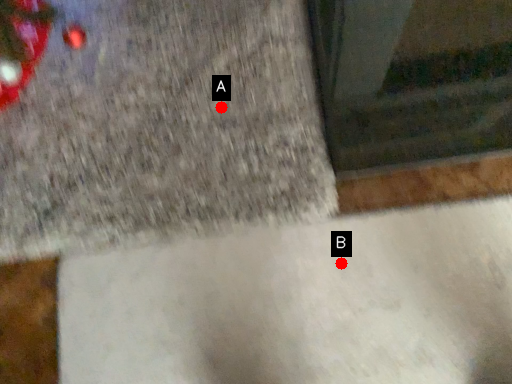
Question: Two points are circled on the image, labeled by A and B beside each circle. Which point is farther from the camera taking this photo?

Choices:
 (A) A is further
 (B) B is further

Answer: (A)